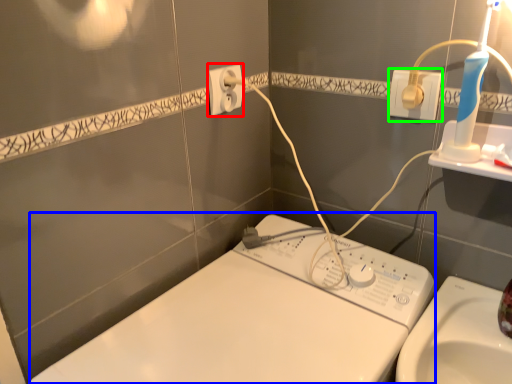
Question: Which is farther away from power plugs and sockets (highlighted by a red box)? machine (highlighted by a blue box) or power plugs and sockets (highlighted by a green box)?

Choices:
 (A) machine
 (B) power plugs and sockets

Answer: (A)